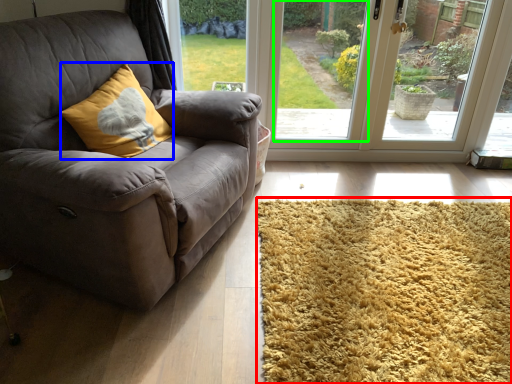
Question: Estimate the real-world distances between objects in this image. Which object is farther from mat (highlighted by a red box), throw pillow (highlighted by a blue box) or window screen (highlighted by a green box)?

Choices:
 (A) throw pillow
 (B) window screen

Answer: (B)